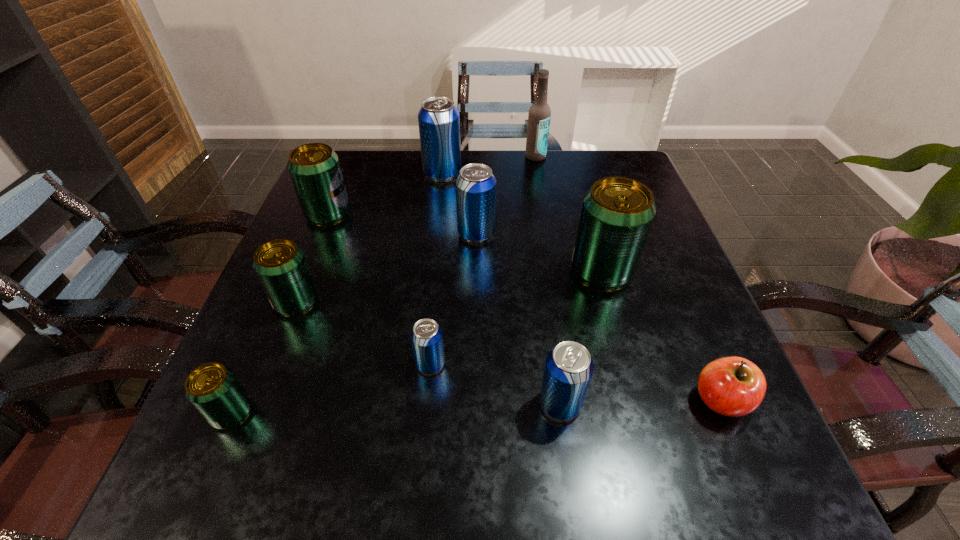
The image size is (960, 540). Identify the location of the rightmost blue beer can. (568, 370).

The height and width of the screenshot is (540, 960). Identify the location of the fourth nearest object. (426, 335).

This screenshot has height=540, width=960. In order to click on the second nearest blue beer can in this screenshot , I will do `click(426, 335)`.

Image resolution: width=960 pixels, height=540 pixels. What are the coordinates of `the nearest green beer can` in the screenshot? It's located at (213, 389).

The height and width of the screenshot is (540, 960). I want to click on apple, so click(733, 386).

Identify the location of vacant space located on the label of the farthest object. pos(540,183).

The width and height of the screenshot is (960, 540). I want to click on free spot located 0.050m on the left of the farthest beer can, so click(405, 174).

You are a GUI agent. You are given a task and a screenshot of the screen. Output one action in this format:
    pyautogui.click(x=<x>, y=<y>)
    Task: Click on the vacant space located 0.070m on the front of the second object from right to left
    
    Given the screenshot: What is the action you would take?
    pyautogui.click(x=615, y=321)

At what (x,y) coordinates should I click in order to perform the action: click on free spot located on the right of the farthest green beer can. Please return your answer as a coordinate pair (x, y). Image resolution: width=960 pixels, height=540 pixels. Looking at the image, I should click on (481, 214).

I want to click on vacant position located on the left of the third smallest blue beer can, so click(389, 233).